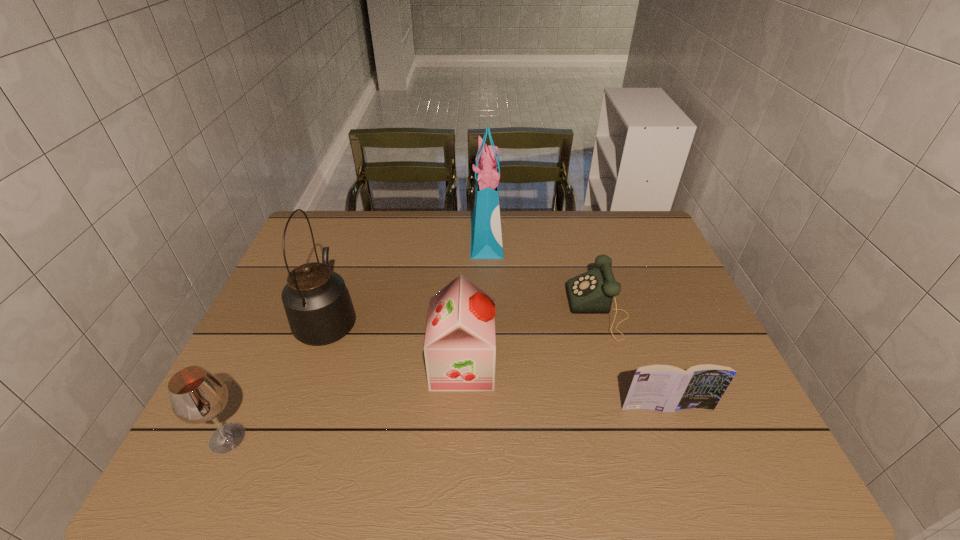
The height and width of the screenshot is (540, 960). In order to click on vacant point located between the third tallest object and the shortest object in this screenshot , I will do `click(530, 338)`.

Where is `vacant space in between the kettle and the third tallest object`? This screenshot has width=960, height=540. vacant space in between the kettle and the third tallest object is located at coordinates (396, 342).

You are a GUI agent. You are given a task and a screenshot of the screen. Output one action in this format:
    pyautogui.click(x=<x>, y=<y>)
    Task: Click on the vacant space in between the third shortest object and the telephone
    
    Given the screenshot: What is the action you would take?
    pyautogui.click(x=413, y=374)

I want to click on vacant area that lies between the book and the kettle, so click(x=497, y=363).

I want to click on vacant point located between the third tallest object and the telephone, so click(x=530, y=338).

The height and width of the screenshot is (540, 960). Identify the location of free space between the shortest object and the shopping bag. (542, 273).

Find the location of a particular element. This screenshot has height=540, width=960. vacant space that's between the shopping bag and the third shortest object is located at coordinates pyautogui.click(x=357, y=338).

You are a GUI agent. You are given a task and a screenshot of the screen. Output one action in this format:
    pyautogui.click(x=<x>, y=<y>)
    Task: Click on the fifth closest object to the shopping bag
    The image size is (960, 540).
    Given the screenshot: What is the action you would take?
    pyautogui.click(x=197, y=396)

Locate which object ranks second in proximity to the nearest object. Please provide its 2D coordinates. Your answer should be formatted as a tuple, i.e. [(x, y)], where the tuple contains the x and y coordinates of a point satisfying the conditions above.

[(460, 348)]

Where is `vacant position in the image that satisfies the following two spatial constraints: 1. on the front side of the farthest object; 2. with the cap open on the third tallest object`? The height and width of the screenshot is (540, 960). vacant position in the image that satisfies the following two spatial constraints: 1. on the front side of the farthest object; 2. with the cap open on the third tallest object is located at coordinates (489, 365).